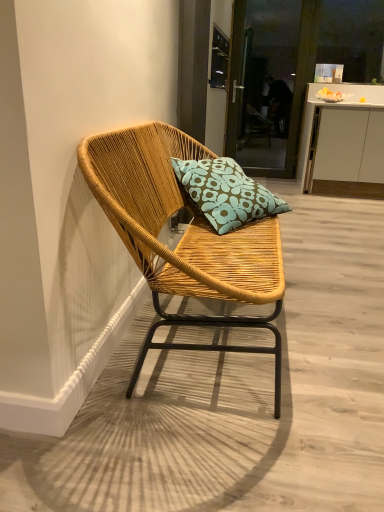
Question: Considering the positions of woven wood chair at center and teal floral cushion at center in the image, is woven wood chair at center taller or shorter than teal floral cushion at center?

Choices:
 (A) short
 (B) tall

Answer: (B)

Question: Considering the relative positions of woven wood chair at center and teal floral cushion at center in the image provided, is woven wood chair at center to the left or to the right of teal floral cushion at center?

Choices:
 (A) left
 (B) right

Answer: (A)

Question: Considering the real-world distances, which object is farthest from the woven wood chair at center?

Choices:
 (A) teal floral cushion at center
 (B) white matte cabinet at center
 (C) transparent glass screen door at upper center

Answer: (C)

Question: Estimate the real-world distances between objects in this image. Which object is closer to the white matte cabinet at center?

Choices:
 (A) teal floral cushion at center
 (B) woven wood chair at center
 (C) transparent glass screen door at upper center

Answer: (C)